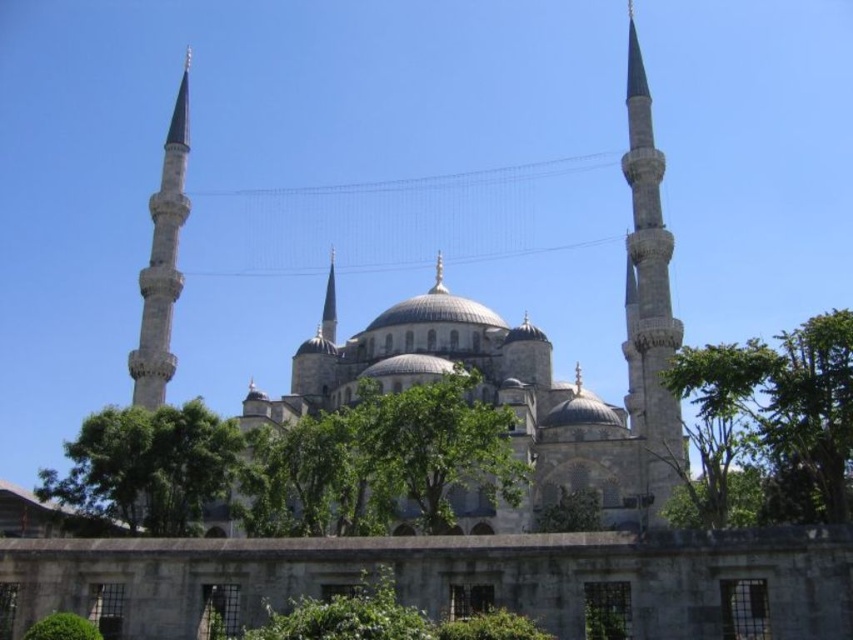
Question: Among these objects, which one is farthest from the camera?

Choices:
 (A) smooth stone minaret at right
 (B) green leafy tree at right

Answer: (A)

Question: Can you confirm if green leafy tree at right is positioned below smooth stone minaret at right?

Choices:
 (A) yes
 (B) no

Answer: (A)

Question: Which point is closer to the camera taking this photo?

Choices:
 (A) (438, 464)
 (B) (112, 422)

Answer: (A)

Question: Observing the image, what is the correct spatial positioning of green leafy tree at center in reference to slate gray stone minaret at left?

Choices:
 (A) right
 (B) left

Answer: (A)

Question: Can you confirm if green leafy tree at lower left is positioned below green leafy tree at center?

Choices:
 (A) yes
 (B) no

Answer: (A)

Question: Which point appears farthest from the camera in this image?

Choices:
 (A) 189,428
 (B) 630,246
 (C) 788,493

Answer: (B)